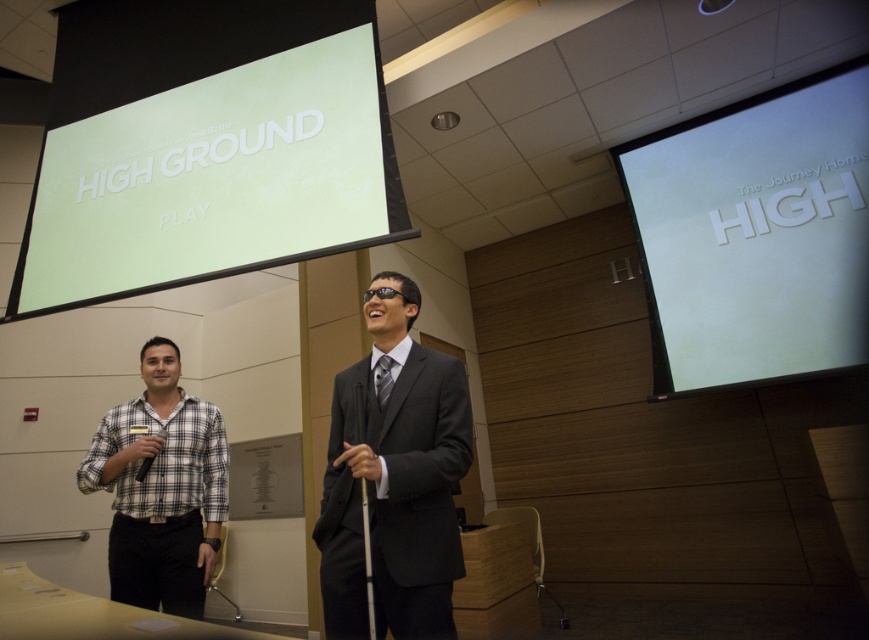
Can you confirm if plaid shirt at left is shorter than black plastic microphone at lower left?

In fact, plaid shirt at left may be taller than black plastic microphone at lower left.

From the picture: Is plaid shirt at left wider than black plastic microphone at lower left?

Yes, plaid shirt at left is wider than black plastic microphone at lower left.

The image size is (869, 640). What do you see at coordinates (161, 488) in the screenshot? I see `plaid shirt at left` at bounding box center [161, 488].

Locate an element on the screen. The image size is (869, 640). plaid shirt at left is located at coordinates (161, 488).

Does white matte projection screen at upper right appear on the right side of black plastic microphone at lower left?

Correct, you'll find white matte projection screen at upper right to the right of black plastic microphone at lower left.

The width and height of the screenshot is (869, 640). Describe the element at coordinates (755, 234) in the screenshot. I see `white matte projection screen at upper right` at that location.

Between point (753, 310) and point (147, 460), which one is positioned behind?

Positioned behind is point (753, 310).

The height and width of the screenshot is (640, 869). What are the coordinates of `white matte projection screen at upper right` in the screenshot? It's located at (755, 234).

Find the location of a particular element. The image size is (869, 640). matte white screen at upper left is located at coordinates tap(204, 145).

Who is shorter, matte white screen at upper left or plaid shirt at left?

plaid shirt at left

This screenshot has width=869, height=640. I want to click on matte white screen at upper left, so click(204, 145).